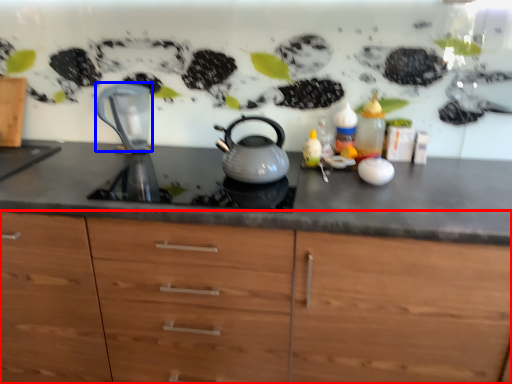
Question: Among these objects, which one is farthest to the camera, cabinetry (highlighted by a red box) or jug (highlighted by a blue box)?

Choices:
 (A) cabinetry
 (B) jug

Answer: (B)